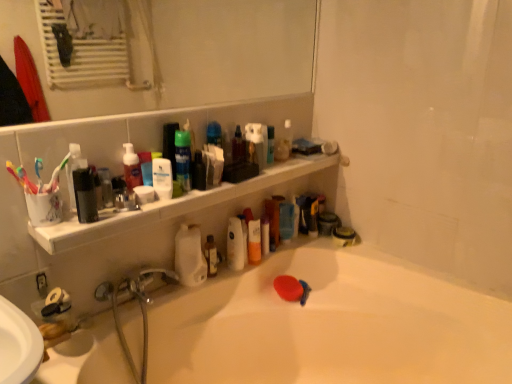
Question: Considering the relative sizes of multicolored plastic toothbrush at left, placed as the 1th toothbrush when sorted from left to right, and white matte lotion at upper center, the 3th mouthwash from the front, in the image provided, is multicolored plastic toothbrush at left, placed as the 1th toothbrush when sorted from left to right, smaller than white matte lotion at upper center, the 3th mouthwash from the front,?

Choices:
 (A) no
 (B) yes

Answer: (B)

Question: Is multicolored plastic toothbrush at left, placed as the 1th toothbrush when sorted from left to right, thinner than white matte lotion at upper center, which ranks as the third mouthwash in back-to-front order?

Choices:
 (A) yes
 (B) no

Answer: (B)

Question: Does multicolored plastic toothbrush at left, placed as the 1th toothbrush when sorted from left to right, have a larger size compared to white matte lotion at upper center, which ranks as the third mouthwash in back-to-front order?

Choices:
 (A) no
 (B) yes

Answer: (A)

Question: Does multicolored plastic toothbrush at left, positioned as the 2th toothbrush in right-to-left order, have a greater height compared to white matte lotion at upper center, the 3th mouthwash from the front?

Choices:
 (A) yes
 (B) no

Answer: (B)

Question: Is multicolored plastic toothbrush at left, placed as the 1th toothbrush when sorted from left to right, looking in the opposite direction of white matte lotion at upper center, marked as the third mouthwash in a right-to-left arrangement?

Choices:
 (A) yes
 (B) no

Answer: (B)

Question: From the image's perspective, is multicolored plastic toothbrush at left, positioned as the 2th toothbrush in right-to-left order, under white matte lotion at upper center, marked as the third mouthwash in a right-to-left arrangement?

Choices:
 (A) no
 (B) yes

Answer: (B)

Question: Is translucent plastic spray bottle at upper center, which is counted as the 3th toiletry, starting from the top, turned away from white matte lotion at upper center, which ranks as the third mouthwash in back-to-front order?

Choices:
 (A) yes
 (B) no

Answer: (B)

Question: Is the position of translucent plastic spray bottle at upper center, which is counted as the second toiletry, starting from the bottom, more distant than that of white matte lotion at upper center, the 3th mouthwash from the front?

Choices:
 (A) no
 (B) yes

Answer: (B)

Question: Does translucent plastic spray bottle at upper center, arranged as the 4th toiletry when viewed from the right, have a greater height compared to white matte lotion at upper center, which ranks as the third mouthwash in back-to-front order?

Choices:
 (A) yes
 (B) no

Answer: (A)

Question: From the image's perspective, is translucent plastic spray bottle at upper center, which is counted as the 3th toiletry, starting from the top, on white matte lotion at upper center, arranged as the third mouthwash when viewed from the left?

Choices:
 (A) no
 (B) yes

Answer: (B)

Question: Is translucent plastic spray bottle at upper center, marked as the fourth toiletry in a back-to-front arrangement, located outside white matte lotion at upper center, arranged as the third mouthwash when viewed from the left?

Choices:
 (A) no
 (B) yes

Answer: (B)

Question: Considering the relative sizes of translucent plastic spray bottle at upper center, the 1th toiletry viewed from the front, and white matte lotion at upper center, the 3th mouthwash from the front, in the image provided, is translucent plastic spray bottle at upper center, the 1th toiletry viewed from the front, wider than white matte lotion at upper center, the 3th mouthwash from the front,?

Choices:
 (A) yes
 (B) no

Answer: (A)

Question: From the image's perspective, would you say matte black soap at lower right, which is counted as the first toiletry, starting from the right, is shown under white glossy bathtub at lower center?

Choices:
 (A) yes
 (B) no

Answer: (B)